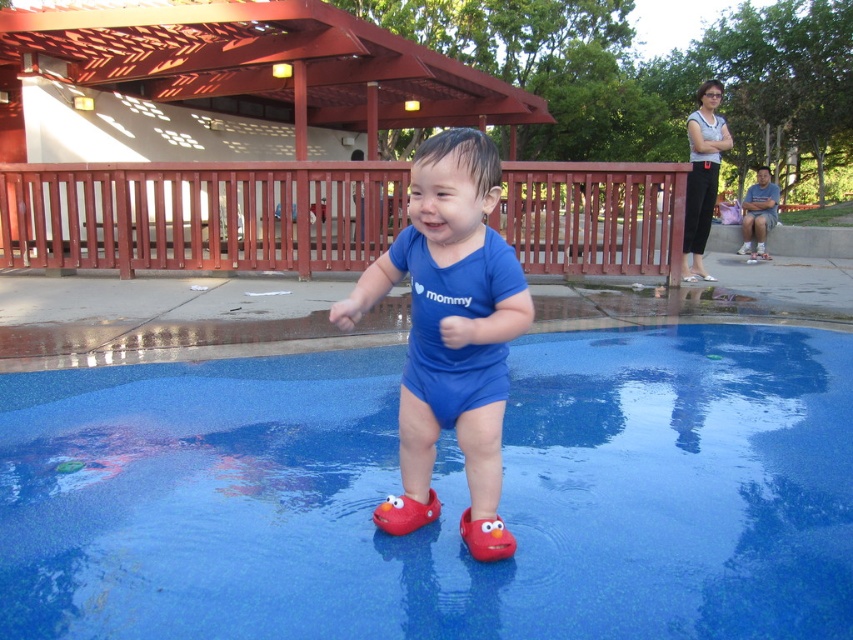
You are a photographer trying to capture the child in the scene. You notice two blue items of clothing at the center of the image. Which one is taller, the blue matte onesie at center or the blue cotton shirt at center?

The blue matte onesie at center is taller than the blue cotton shirt at center.

You are a parent holding a 1.6 meter tall toddler who wants to play in the blue textured pool at center. The toddler is currently standing 2 meters away from the pool. Can you safely carry the toddler to the pool without crossing the red railing surrounding it?

The blue textured pool at center is 1.85 meters away from camera. Since the toddler is currently 2 meters away from the pool, the parent can safely carry the toddler to the pool without crossing the red railing surrounding it as the distance is manageable and the path is clear.